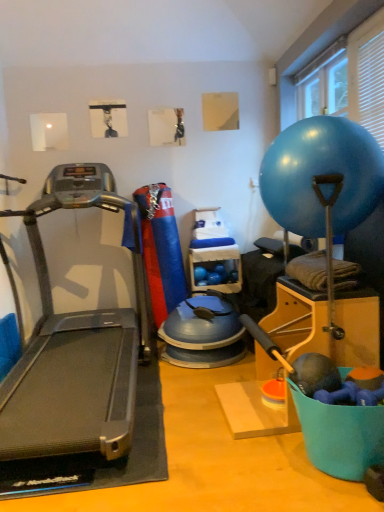
The image size is (384, 512). What do you see at coordinates (75, 346) in the screenshot?
I see `silver metallic treadmill at left` at bounding box center [75, 346].

Locate an element on the screen. silver metallic treadmill at left is located at coordinates (75, 346).

The image size is (384, 512). Describe the element at coordinates (323, 82) in the screenshot. I see `transparent plastic window screen at upper right` at that location.

Locate an element on the screen. The height and width of the screenshot is (512, 384). blue rubber ball at upper right is located at coordinates point(322,176).

Considering the sizes of transparent plastic window screen at upper right and silver metallic treadmill at left in the image, is transparent plastic window screen at upper right bigger or smaller than silver metallic treadmill at left?

transparent plastic window screen at upper right is smaller than silver metallic treadmill at left.

Is point (310, 90) farther from camera compared to point (80, 325)?

Yes, point (310, 90) is behind point (80, 325).

How different are the orientations of transparent plastic window screen at upper right and silver metallic treadmill at left in degrees?

90 degrees separate the facing orientations of transparent plastic window screen at upper right and silver metallic treadmill at left.

Does transparent plastic window screen at upper right lie behind silver metallic treadmill at left?

Yes, it is behind silver metallic treadmill at left.

How many degrees apart are the facing directions of blue rubber ball at upper right and clear plastic container at center?

blue rubber ball at upper right and clear plastic container at center are facing 90.7 degrees away from each other.

Is clear plastic container at center a part of blue rubber ball at upper right?

No, clear plastic container at center is not surrounded by blue rubber ball at upper right.

From a real-world perspective, is blue rubber ball at upper right beneath clear plastic container at center?

Actually, blue rubber ball at upper right is physically above clear plastic container at center in the real world.

From a real-world perspective, is silver metallic treadmill at left above or below transparent plastic window screen at upper right?

From a real-world perspective, silver metallic treadmill at left is physically below transparent plastic window screen at upper right.

Can you confirm if silver metallic treadmill at left is thinner than transparent plastic window screen at upper right?

Incorrect, the width of silver metallic treadmill at left is not less than that of transparent plastic window screen at upper right.

Is silver metallic treadmill at left turned away from transparent plastic window screen at upper right?

No, silver metallic treadmill at left is not facing the opposite direction of transparent plastic window screen at upper right.

Considering the sizes of objects silver metallic treadmill at left and transparent plastic window screen at upper right in the image provided, who is bigger, silver metallic treadmill at left or transparent plastic window screen at upper right?

Bigger between the two is silver metallic treadmill at left.

Does clear plastic container at center touch silver metallic treadmill at left?

They are not placed beside each other.

From a real-world perspective, which object rests below the other?

In real-world perspective, clear plastic container at center is lower.

Who is taller, clear plastic container at center or silver metallic treadmill at left?

silver metallic treadmill at left is taller.

Is silver metallic treadmill at left located within clear plastic container at center?

No, silver metallic treadmill at left is not surrounded by clear plastic container at center.

From the image's perspective, does silver metallic treadmill at left appear lower than clear plastic container at center?

No.

Is silver metallic treadmill at left bigger or smaller than clear plastic container at center?

silver metallic treadmill at left is bigger than clear plastic container at center.

What's the angular difference between silver metallic treadmill at left and clear plastic container at center's facing directions?

1.18 degrees separate the facing orientations of silver metallic treadmill at left and clear plastic container at center.

Is silver metallic treadmill at left not near clear plastic container at center?

silver metallic treadmill at left is near clear plastic container at center, not far away.

Is clear plastic container at center at the back of transparent plastic window screen at upper right?

No, transparent plastic window screen at upper right's orientation is not away from clear plastic container at center.

Which of these two, transparent plastic window screen at upper right or clear plastic container at center, stands taller?

With more height is clear plastic container at center.

Does transparent plastic window screen at upper right contain clear plastic container at center?

No, clear plastic container at center is not a part of transparent plastic window screen at upper right.

Considering the relative sizes of blue rubber ball at upper right and silver metallic treadmill at left in the image provided, is blue rubber ball at upper right taller than silver metallic treadmill at left?

No.

Considering the positions of points (365, 148) and (45, 285), is point (365, 148) farther from camera compared to point (45, 285)?

No, (365, 148) is closer to viewer.

Consider the image. From a real-world perspective, between blue rubber ball at upper right and silver metallic treadmill at left, who is vertically lower?

silver metallic treadmill at left is physically lower.

Between blue rubber ball at upper right and silver metallic treadmill at left, which one appears on the left side from the viewer's perspective?

Positioned to the left is silver metallic treadmill at left.

At what (x,y) coordinates should I click in order to perform the action: click on treadmill beneath the transparent plastic window screen at upper right (from a real-world perspective). Please return your answer as a coordinate pair (x, y). Looking at the image, I should click on (75, 346).

This screenshot has width=384, height=512. What are the coordinates of `shelf that is below the blue rubber ball at upper right (from the image's perspective)` in the screenshot? It's located at (213, 267).

Which object lies further to the anchor point blue rubber ball at upper right, transparent plastic window screen at upper right or clear plastic container at center?

clear plastic container at center.

From the image, which object appears to be farther from silver metallic treadmill at left, transparent plastic window screen at upper right or blue rubber ball at upper right?

transparent plastic window screen at upper right lies further to silver metallic treadmill at left than the other object.

From the image, which object appears to be farther from clear plastic container at center, transparent plastic window screen at upper right or blue rubber ball at upper right?

Based on the image, blue rubber ball at upper right appears to be further to clear plastic container at center.

Based on their spatial positions, is transparent plastic window screen at upper right or clear plastic container at center closer to silver metallic treadmill at left?

clear plastic container at center is positioned closer to the anchor silver metallic treadmill at left.

Which object lies nearer to the anchor point silver metallic treadmill at left, clear plastic container at center or blue rubber ball at upper right?

clear plastic container at center is positioned closer to the anchor silver metallic treadmill at left.

Looking at the image, which one is located closer to silver metallic treadmill at left, clear plastic container at center or transparent plastic window screen at upper right?

clear plastic container at center.

Looking at the image, which one is located closer to blue rubber ball at upper right, silver metallic treadmill at left or transparent plastic window screen at upper right?

Among the two, transparent plastic window screen at upper right is located nearer to blue rubber ball at upper right.

Estimate the real-world distances between objects in this image. Which object is closer to blue rubber ball at upper right, silver metallic treadmill at left or clear plastic container at center?

silver metallic treadmill at left is positioned closer to the anchor blue rubber ball at upper right.

You are a GUI agent. You are given a task and a screenshot of the screen. Output one action in this format:
    pyautogui.click(x=<x>, y=<y>)
    Task: Click on the ball between transparent plastic window screen at upper right and clear plastic container at center in the vertical direction
    The height and width of the screenshot is (512, 384).
    Given the screenshot: What is the action you would take?
    pyautogui.click(x=322, y=176)

Where is `window screen between silver metallic treadmill at left and clear plastic container at center along the z-axis`? Image resolution: width=384 pixels, height=512 pixels. window screen between silver metallic treadmill at left and clear plastic container at center along the z-axis is located at coordinates (323, 82).

The image size is (384, 512). In order to click on ball between silver metallic treadmill at left and clear plastic container at center along the z-axis in this screenshot , I will do `click(322, 176)`.

At what (x,y) coordinates should I click in order to perform the action: click on ball between silver metallic treadmill at left and transparent plastic window screen at upper right from left to right. Please return your answer as a coordinate pair (x, y). The image size is (384, 512). Looking at the image, I should click on (322, 176).